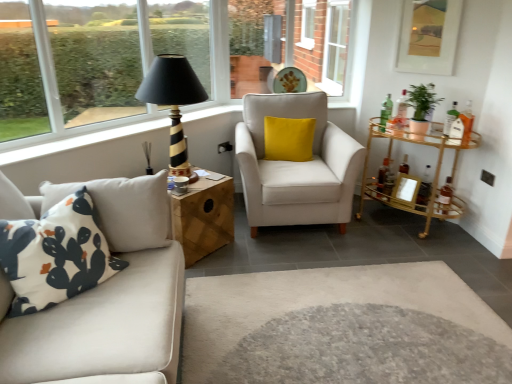
Question: Is white plastic window at upper center, the second window positioned from the front, beside yellow velvet pillow at center, which is the 2th pillow from left to right?

Choices:
 (A) yes
 (B) no

Answer: (B)

Question: Does white plastic window at upper center, the second window positioned from the front, have a lesser height compared to yellow velvet pillow at center, which is the 1th pillow from back to front?

Choices:
 (A) yes
 (B) no

Answer: (B)

Question: Is white plastic window at upper center, the second window positioned from the front, at the right side of yellow velvet pillow at center, which ranks as the 2th pillow in bottom-to-top order?

Choices:
 (A) yes
 (B) no

Answer: (A)

Question: Does white plastic window at upper center, the second window positioned from the front, come in front of yellow velvet pillow at center, which is the 2th pillow from left to right?

Choices:
 (A) no
 (B) yes

Answer: (A)

Question: From the image's perspective, does white plastic window at upper center, which appears as the first window when viewed from the back, appear higher than yellow velvet pillow at center, the 1th pillow from the right?

Choices:
 (A) no
 (B) yes

Answer: (B)

Question: Could you tell me if white plastic window at upper center, which appears as the first window when viewed from the back, is turned towards yellow velvet pillow at center, the 1th pillow from the right?

Choices:
 (A) yes
 (B) no

Answer: (B)

Question: Would you say wooden picture frame at right, acting as the 2th picture frame starting from the top, contains yellow velvet pillow at center, which is the 1th pillow from back to front?

Choices:
 (A) no
 (B) yes

Answer: (A)

Question: From a real-world perspective, is wooden picture frame at right, acting as the 2th picture frame starting from the top, on yellow velvet pillow at center, the 1th pillow from the right?

Choices:
 (A) no
 (B) yes

Answer: (A)

Question: Does wooden picture frame at right, acting as the 2th picture frame starting from the top, turn towards yellow velvet pillow at center, acting as the 2th pillow starting from the front?

Choices:
 (A) yes
 (B) no

Answer: (B)

Question: Does wooden picture frame at right, arranged as the first picture frame when ordered from the bottom, have a lesser width compared to yellow velvet pillow at center, which is the 1th pillow from back to front?

Choices:
 (A) yes
 (B) no

Answer: (A)

Question: Can you confirm if wooden picture frame at right, acting as the 2th picture frame starting from the top, is positioned to the left of yellow velvet pillow at center, the 1th pillow from the right?

Choices:
 (A) yes
 (B) no

Answer: (B)

Question: Would you say wooden picture frame at right, arranged as the first picture frame when ordered from the bottom, is outside yellow velvet pillow at center, which is the 1th pillow from back to front?

Choices:
 (A) yes
 (B) no

Answer: (A)

Question: From a real-world perspective, is gold metallic bar cart at right, which is the 2th table in left-to-right order, over white printed cushion at left, which is the 1th pillow in front-to-back order?

Choices:
 (A) no
 (B) yes

Answer: (A)